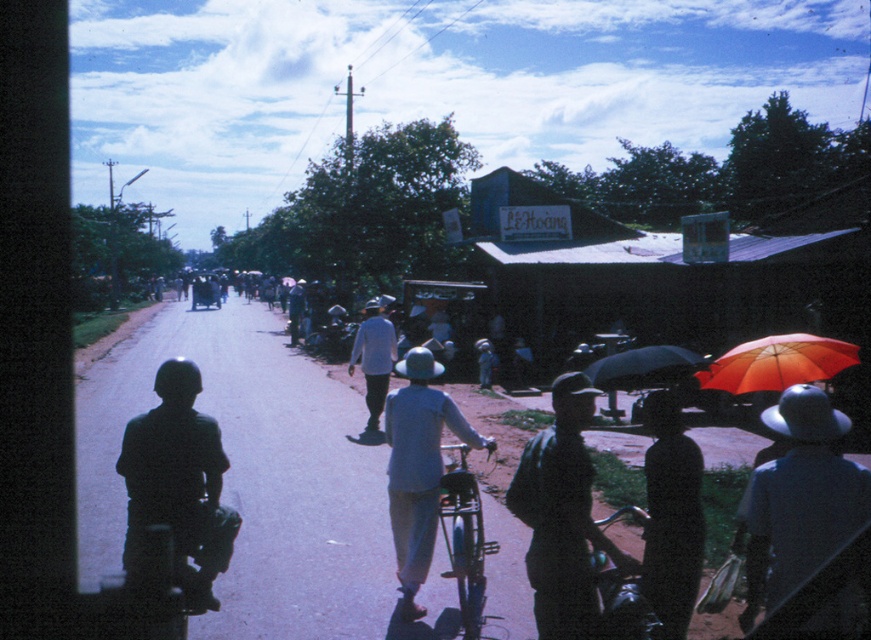
You are a photographer standing on the road in the scene. You want to take a picture of the shiny chrome motorcycle at lower right and the black matte hat at lower right. Which object should you focus on first if you want to include both in your frame without moving the camera?

You should focus on the black matte hat at lower right first because it is larger in size compared to the shiny chrome motorcycle at lower right, so it will take up more space in the frame.

You are a delivery driver who needs to park your shiny chrome motorcycle at lower right. The parking spot can only accommodate vehicles narrower than the light blue fabric hat at center. Can your motorcycle fit?

The shiny chrome motorcycle at lower right is narrower than the light blue fabric hat at center, so it can fit in the parking spot.

You are a fashion designer observing the dark gray uniform at center and the black matte hat at lower right in the image. Which of these two items has a greater width?

The dark gray uniform at center has a greater width than the black matte hat at lower right.